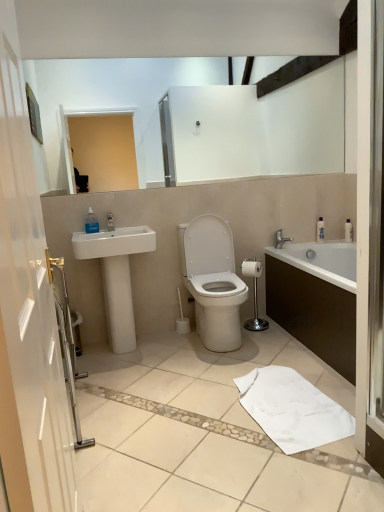
Question: Is the depth of transparent glass screen door at right less than that of white glossy toilet at center?

Choices:
 (A) no
 (B) yes

Answer: (B)

Question: Is transparent glass screen door at right at the left side of white glossy toilet at center?

Choices:
 (A) no
 (B) yes

Answer: (A)

Question: Can you confirm if transparent glass screen door at right is bigger than white glossy toilet at center?

Choices:
 (A) yes
 (B) no

Answer: (B)

Question: Is transparent glass screen door at right further to the viewer compared to white glossy toilet at center?

Choices:
 (A) no
 (B) yes

Answer: (A)

Question: From a real-world perspective, does transparent glass screen door at right sit lower than white glossy toilet at center?

Choices:
 (A) no
 (B) yes

Answer: (A)

Question: Is transparent glass screen door at right at the right side of white glossy toilet at center?

Choices:
 (A) no
 (B) yes

Answer: (B)

Question: Can you confirm if chrome metallic toilet paper holder at center is thinner than white glossy sink at left?

Choices:
 (A) yes
 (B) no

Answer: (A)

Question: Considering the relative positions of chrome metallic toilet paper holder at center and white glossy sink at left in the image provided, is chrome metallic toilet paper holder at center to the left of white glossy sink at left from the viewer's perspective?

Choices:
 (A) yes
 (B) no

Answer: (B)

Question: Does chrome metallic toilet paper holder at center come in front of white glossy sink at left?

Choices:
 (A) no
 (B) yes

Answer: (A)

Question: Is chrome metallic toilet paper holder at center outside white glossy sink at left?

Choices:
 (A) yes
 (B) no

Answer: (A)

Question: From the image's perspective, is chrome metallic toilet paper holder at center under white glossy sink at left?

Choices:
 (A) yes
 (B) no

Answer: (A)

Question: Would you say white glossy sink at left is part of chrome metallic toilet paper holder at center's contents?

Choices:
 (A) no
 (B) yes

Answer: (A)

Question: Considering the relative sizes of white glossy sink at left and white cotton bath towel at lower center in the image provided, is white glossy sink at left smaller than white cotton bath towel at lower center?

Choices:
 (A) no
 (B) yes

Answer: (A)